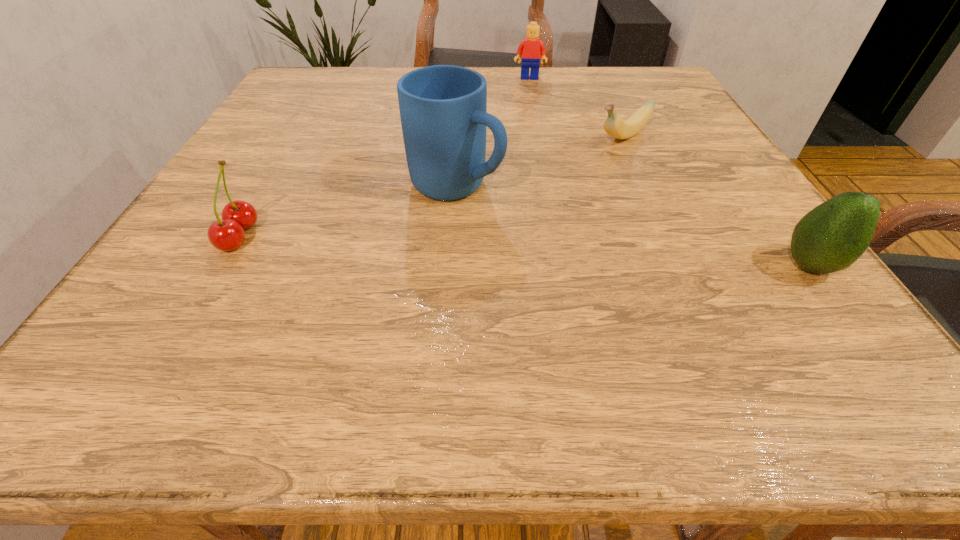
The image size is (960, 540). What are the coordinates of `vacant region that satisfies the following two spatial constraints: 1. on the back side of the third nearest object; 2. on the right side of the shortest object` in the screenshot? It's located at (459, 138).